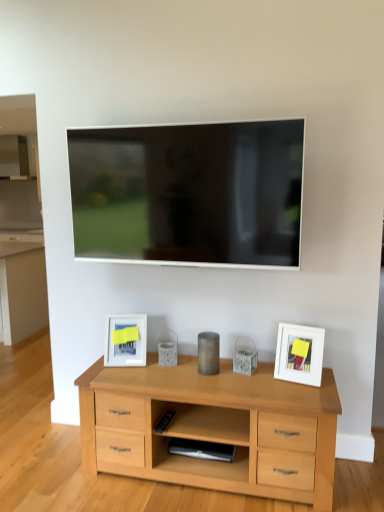
Question: Is white matte picture frame at right, the second picture frame when ordered from back to front, facing away from metallic cylinder at center, the first appliance from the top?

Choices:
 (A) yes
 (B) no

Answer: (B)

Question: Is white matte picture frame at right, the first picture frame when ordered from right to left, positioned behind metallic cylinder at center, the first appliance from the top?

Choices:
 (A) yes
 (B) no

Answer: (B)

Question: Is white matte picture frame at right, marked as the first picture frame in a front-to-back arrangement, thinner than metallic cylinder at center, marked as the second appliance in a bottom-to-top arrangement?

Choices:
 (A) no
 (B) yes

Answer: (B)

Question: Is white matte picture frame at right, the second picture frame viewed from the left, in front of metallic cylinder at center, marked as the second appliance in a bottom-to-top arrangement?

Choices:
 (A) no
 (B) yes

Answer: (B)

Question: From a real-world perspective, is white matte picture frame at right, the first picture frame when ordered from right to left, under metallic cylinder at center, marked as the second appliance in a bottom-to-top arrangement?

Choices:
 (A) yes
 (B) no

Answer: (B)

Question: From a real-world perspective, is white matte picture frame at right, marked as the first picture frame in a front-to-back arrangement, on metallic cylinder at center, marked as the second appliance in a bottom-to-top arrangement?

Choices:
 (A) no
 (B) yes

Answer: (B)

Question: Would you say satin black speaker at lower center, the 2th appliance from the top, is a long distance from white matte picture frame at lower left, which appears as the first picture frame when viewed from the back?

Choices:
 (A) no
 (B) yes

Answer: (A)

Question: Does satin black speaker at lower center, the 1th appliance when ordered from bottom to top, appear on the right side of white matte picture frame at lower left, marked as the 2th picture frame in a front-to-back arrangement?

Choices:
 (A) no
 (B) yes

Answer: (B)

Question: Is satin black speaker at lower center, the 2th appliance from the top, positioned behind white matte picture frame at lower left, the 2th picture frame in the right-to-left sequence?

Choices:
 (A) yes
 (B) no

Answer: (B)

Question: From the image's perspective, is satin black speaker at lower center, the 2th appliance from the top, above white matte picture frame at lower left, which appears as the first picture frame when viewed from the back?

Choices:
 (A) yes
 (B) no

Answer: (B)

Question: Is satin black speaker at lower center, the 2th appliance from the top, bigger than white matte picture frame at lower left, which ranks as the 1th picture frame in left-to-right order?

Choices:
 (A) no
 (B) yes

Answer: (A)

Question: Is satin black speaker at lower center, the 2th appliance from the top, facing away from white matte picture frame at lower left, which appears as the first picture frame when viewed from the back?

Choices:
 (A) yes
 (B) no

Answer: (B)

Question: Does metallic cylinder at center, marked as the second appliance in a bottom-to-top arrangement, have a larger size compared to satin black speaker at lower center, the 2th appliance from the top?

Choices:
 (A) no
 (B) yes

Answer: (A)